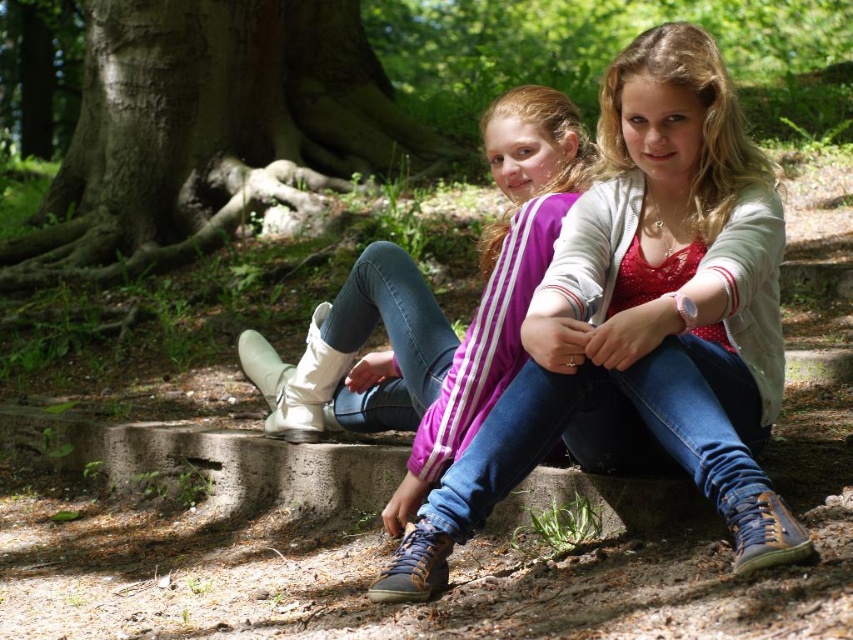
Is smooth brown tree trunk at center behind matte white boots at center?

Yes, it is behind matte white boots at center.

Does smooth brown tree trunk at center appear on the right side of matte white boots at center?

Incorrect, smooth brown tree trunk at center is not on the right side of matte white boots at center.

Is point (195, 99) in front of point (543, 118)?

No, it is behind (543, 118).

Identify the location of smooth brown tree trunk at center. The image size is (853, 640). (210, 131).

Is point (590, 278) less distant than point (386, 116)?

Yes, point (590, 278) is in front of point (386, 116).

Between point (512, 417) and point (102, 147), which one is positioned behind?

The point (102, 147) is more distant.

Identify the location of denim jeans at center. The image size is (853, 640). (645, 314).

Can you confirm if denim jeans at center is taller than matte white boots at center?

Yes, denim jeans at center is taller than matte white boots at center.

Which is more to the right, denim jeans at center or matte white boots at center?

denim jeans at center is more to the right.

You are a GUI agent. You are given a task and a screenshot of the screen. Output one action in this format:
    pyautogui.click(x=<x>, y=<y>)
    Task: Click on the denim jeans at center
    
    Given the screenshot: What is the action you would take?
    pyautogui.click(x=645, y=314)